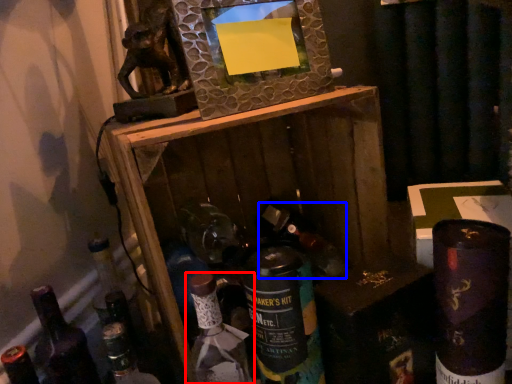
Question: Which object is closer to the camera taking this photo, bottle (highlighted by a red box) or wine bottle (highlighted by a blue box)?

Choices:
 (A) bottle
 (B) wine bottle

Answer: (A)